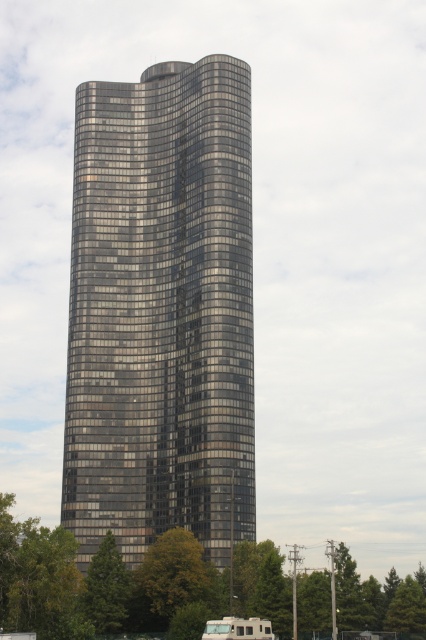
You are a photographer planning to capture the glossy glass tower at center and the white plastic boat at lower center in a single shot. Given their sizes, which object will occupy more of the frame?

The glossy glass tower at center is larger in size than the white plastic boat at lower center, so it will occupy more of the frame.

Looking at this image, you are an architect analyzing the image of a modern cityscape. You need to determine the relative sizes of the structures present. Which object in the scene has a greater width when comparing the glossy glass tower at center and the white plastic boat at lower center?

The glossy glass tower at center has a greater width than the white plastic boat at lower center according to the description.

You are standing in front of the skyscraper and want to take a photo of both the glossy glass tower at center and the white plastic boat at lower center. Which object should you position closer to the left side of the frame?

The glossy glass tower at center should be positioned closer to the left side of the frame since it is already located to the left of the white plastic boat at lower center.